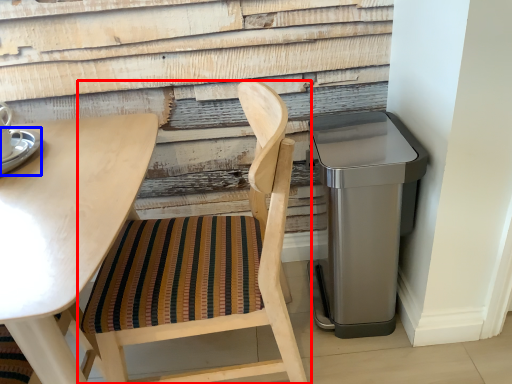
Question: Which of the following is the closest to the observer, chair (highlighted by a red box) or saucer (highlighted by a blue box)?

Choices:
 (A) chair
 (B) saucer

Answer: (A)